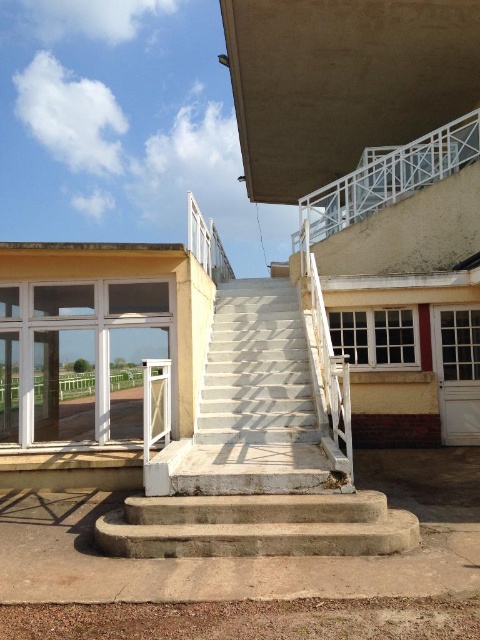
Question: Which object appears closest to the camera in this image?

Choices:
 (A) concrete stairs at center
 (B) white concrete stairs at center

Answer: (A)

Question: Is white concrete stairs at center behind concrete stairs at center?

Choices:
 (A) no
 (B) yes

Answer: (B)

Question: Is white concrete stairs at center closer to camera compared to concrete stairs at center?

Choices:
 (A) yes
 (B) no

Answer: (B)

Question: Is white concrete stairs at center positioned before concrete stairs at center?

Choices:
 (A) no
 (B) yes

Answer: (A)